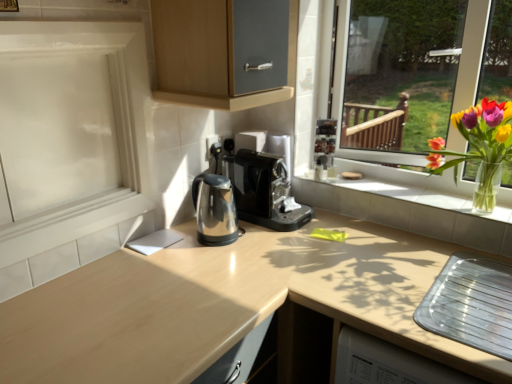
Where is `free space in front of polished metallic kettle at center`? The height and width of the screenshot is (384, 512). free space in front of polished metallic kettle at center is located at coordinates (229, 260).